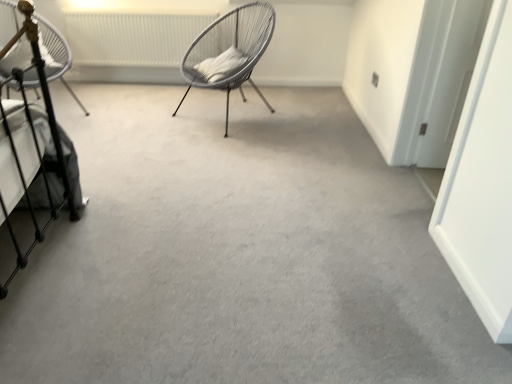
Question: From a real-world perspective, is white woven chair at center, placed as the first chair when sorted from right to left, physically below white textured radiator at upper center?

Choices:
 (A) no
 (B) yes

Answer: (A)

Question: Is white woven chair at center, placed as the first chair when sorted from right to left, surrounding white textured radiator at upper center?

Choices:
 (A) no
 (B) yes

Answer: (A)

Question: Considering the relative positions of white woven chair at center, placed as the first chair when sorted from right to left, and white textured radiator at upper center in the image provided, is white woven chair at center, placed as the first chair when sorted from right to left, in front of white textured radiator at upper center?

Choices:
 (A) no
 (B) yes

Answer: (B)

Question: Can you confirm if white woven chair at center, placed as the first chair when sorted from right to left, is shorter than white textured radiator at upper center?

Choices:
 (A) no
 (B) yes

Answer: (A)

Question: Is white woven chair at center, acting as the 2th chair starting from the left, smaller than white textured radiator at upper center?

Choices:
 (A) no
 (B) yes

Answer: (A)

Question: Considering the relative sizes of white woven chair at center, acting as the 2th chair starting from the left, and white textured radiator at upper center in the image provided, is white woven chair at center, acting as the 2th chair starting from the left, wider than white textured radiator at upper center?

Choices:
 (A) no
 (B) yes

Answer: (B)

Question: From the image's perspective, is white textured radiator at upper center on top of white woven chair at center, placed as the first chair when sorted from right to left?

Choices:
 (A) no
 (B) yes

Answer: (B)

Question: Would you consider white textured radiator at upper center to be distant from white woven chair at center, placed as the first chair when sorted from right to left?

Choices:
 (A) yes
 (B) no

Answer: (B)

Question: Does white textured radiator at upper center have a larger size compared to white woven chair at center, acting as the 2th chair starting from the left?

Choices:
 (A) yes
 (B) no

Answer: (B)

Question: Is white textured radiator at upper center aimed at white woven chair at center, acting as the 2th chair starting from the left?

Choices:
 (A) yes
 (B) no

Answer: (A)

Question: Would you say white woven chair at center, placed as the first chair when sorted from right to left, is part of white textured radiator at upper center's contents?

Choices:
 (A) yes
 (B) no

Answer: (B)

Question: Can you confirm if white textured radiator at upper center is shorter than white woven chair at center, placed as the first chair when sorted from right to left?

Choices:
 (A) no
 (B) yes

Answer: (B)

Question: Is white woven chair at left, which is counted as the second chair, starting from the right, outside of white textured radiator at upper center?

Choices:
 (A) no
 (B) yes

Answer: (B)